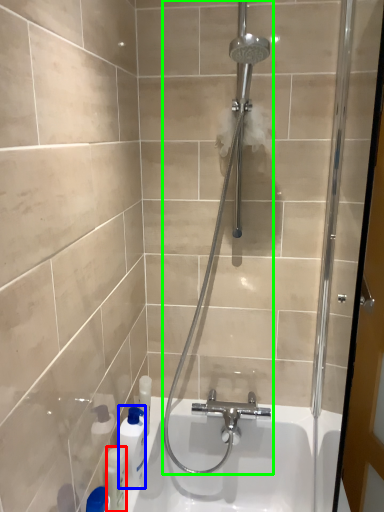
Question: Considering the real-world distances, which object is closest to toiletry (highlighted by a red box)? cleaning product (highlighted by a blue box) or shower (highlighted by a green box).

Choices:
 (A) cleaning product
 (B) shower

Answer: (A)